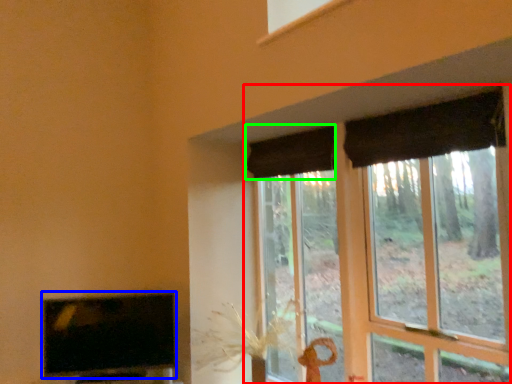
Question: Which object is the farthest from window (highlighted by a red box)? Choose among these: television (highlighted by a blue box) or curtain (highlighted by a green box).

Choices:
 (A) television
 (B) curtain

Answer: (A)